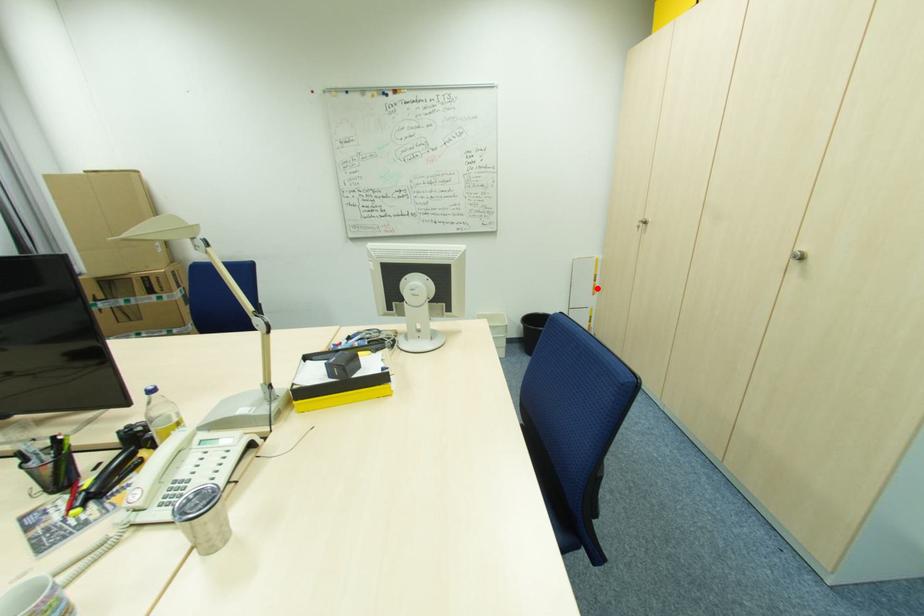
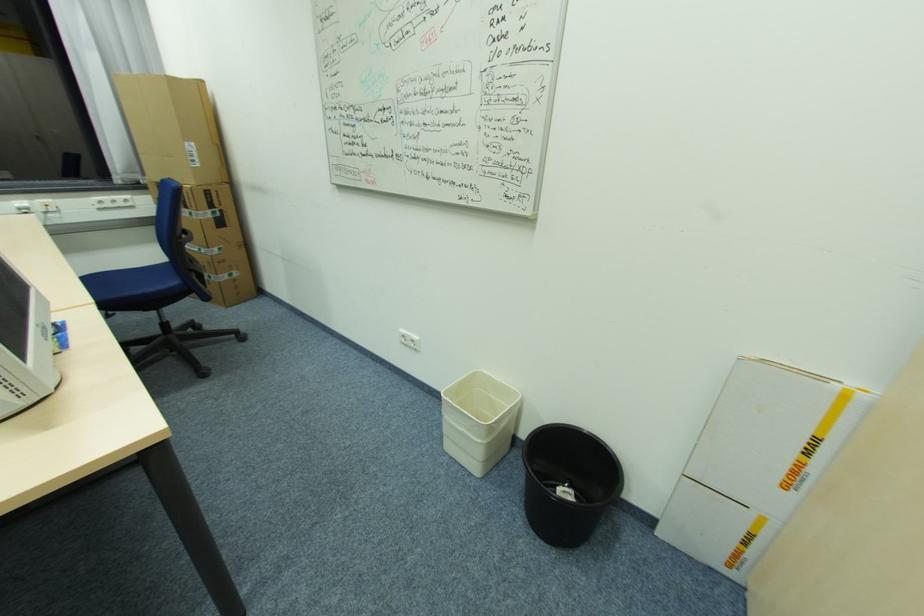
Locate, in the second image, the point that corresponds to the highlighted location in the first image.

(797, 472)